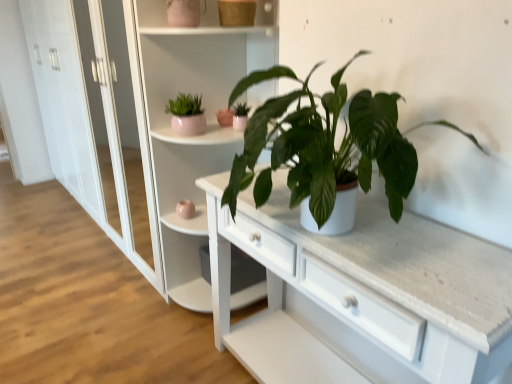
Question: Considering the relative sizes of pink ceramic flowerpot at upper center and matte pink pot at upper left, which is the 1th houseplant from left to right, in the image provided, is pink ceramic flowerpot at upper center wider than matte pink pot at upper left, which is the 1th houseplant from left to right,?

Choices:
 (A) no
 (B) yes

Answer: (A)

Question: Is pink ceramic flowerpot at upper center smaller than matte pink pot at upper left, which is the 1th houseplant from left to right?

Choices:
 (A) yes
 (B) no

Answer: (A)

Question: Is pink ceramic flowerpot at upper center positioned behind matte pink pot at upper left, which is the 1th houseplant from left to right?

Choices:
 (A) yes
 (B) no

Answer: (A)

Question: From the image's perspective, would you say pink ceramic flowerpot at upper center is shown under matte pink pot at upper left, which ranks as the 2th houseplant in front-to-back order?

Choices:
 (A) yes
 (B) no

Answer: (B)

Question: Does pink ceramic flowerpot at upper center have a lesser height compared to matte pink pot at upper left, which is the 1th houseplant from left to right?

Choices:
 (A) no
 (B) yes

Answer: (B)

Question: Is pink ceramic flowerpot at upper center far away from matte pink pot at upper left, the 2th houseplant positioned from the back?

Choices:
 (A) no
 (B) yes

Answer: (A)

Question: From a real-world perspective, is matte pink pot at upper left, the 2th houseplant positioned from the back, physically below green matte plant at center, marked as the first houseplant in a right-to-left arrangement?

Choices:
 (A) no
 (B) yes

Answer: (B)

Question: Is matte pink pot at upper left, the 2th houseplant positioned from the back, at the left side of green matte plant at center, which ranks as the third houseplant in back-to-front order?

Choices:
 (A) yes
 (B) no

Answer: (A)

Question: Considering the relative sizes of matte pink pot at upper left, which ranks as the 2th houseplant in front-to-back order, and green matte plant at center, marked as the first houseplant in a right-to-left arrangement, in the image provided, is matte pink pot at upper left, which ranks as the 2th houseplant in front-to-back order, bigger than green matte plant at center, marked as the first houseplant in a right-to-left arrangement,?

Choices:
 (A) yes
 (B) no

Answer: (B)

Question: Does matte pink pot at upper left, which is the 1th houseplant from left to right, touch green matte plant at center, which is the third houseplant in left-to-right order?

Choices:
 (A) yes
 (B) no

Answer: (B)

Question: Is matte pink pot at upper left, the third houseplant viewed from the right, positioned before green matte plant at center, which is the third houseplant in left-to-right order?

Choices:
 (A) no
 (B) yes

Answer: (A)

Question: From a real-world perspective, is matte pink pot at upper left, the 2th houseplant positioned from the back, on green matte plant at center, which ranks as the third houseplant in back-to-front order?

Choices:
 (A) no
 (B) yes

Answer: (A)

Question: Is matte white pot at center, marked as the second houseplant in a left-to-right arrangement, to the right of green matte plant at center, the 1th houseplant positioned from the front, from the viewer's perspective?

Choices:
 (A) no
 (B) yes

Answer: (A)